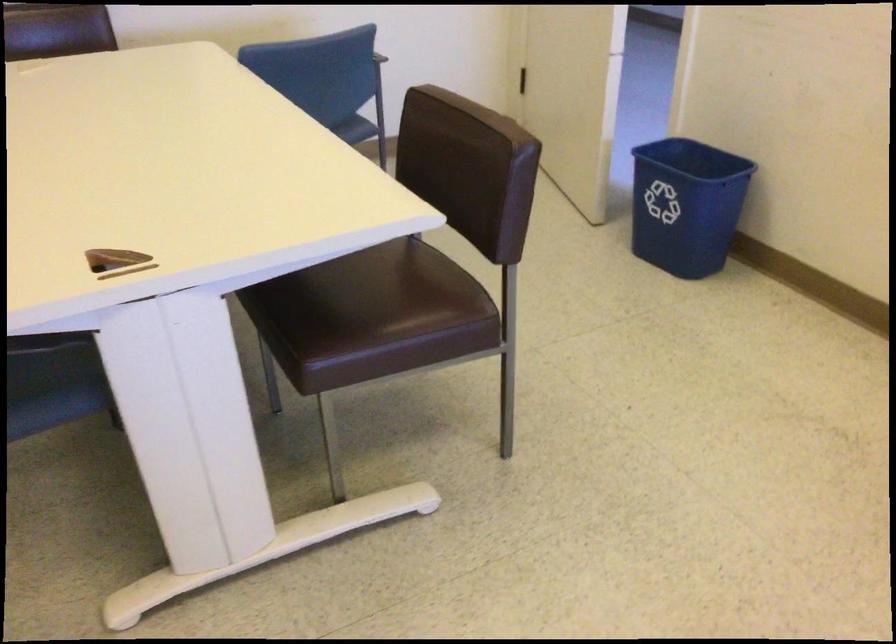
Describe the element at coordinates (392, 317) in the screenshot. I see `a brown chair sitting surface` at that location.